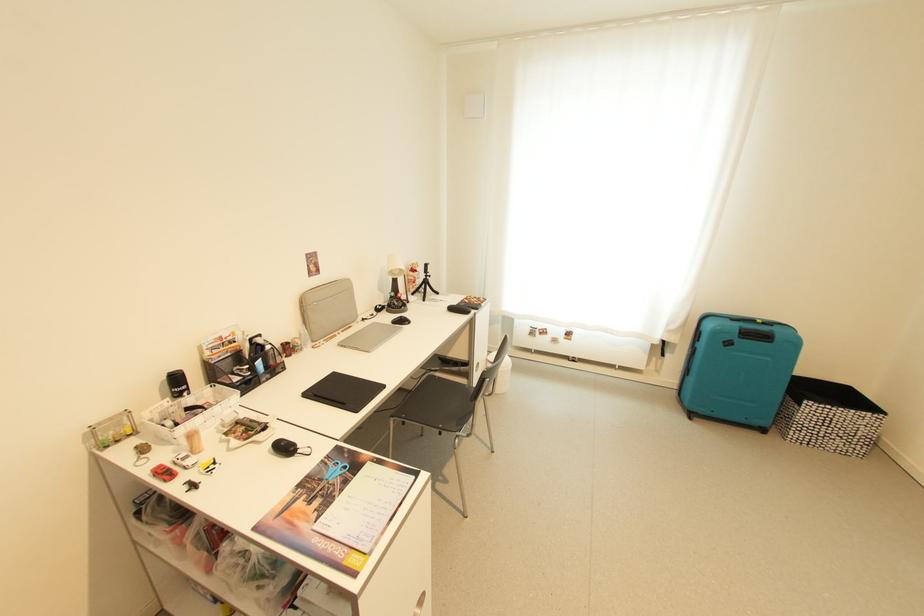
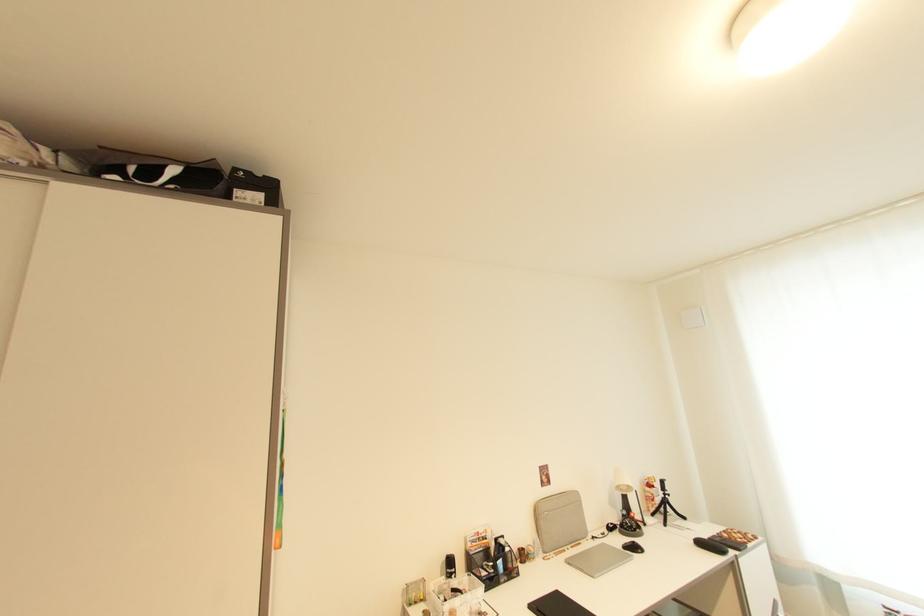
Find the pixel in the second image that matches point (169, 379) in the first image.

(450, 561)